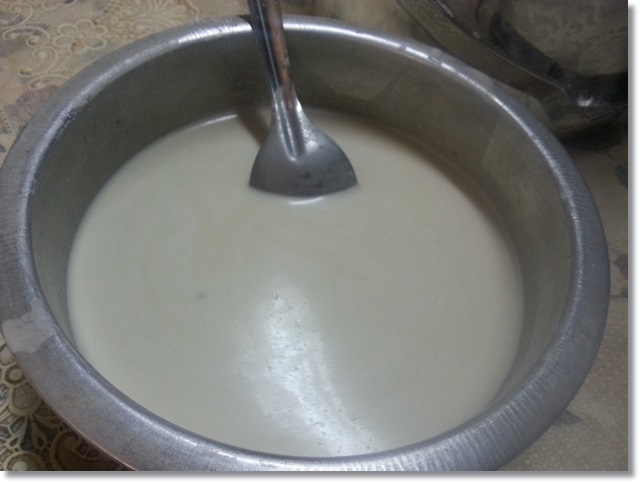
In order to click on top left corner table cover in this screenshot , I will do `click(63, 13)`, `click(28, 76)`.